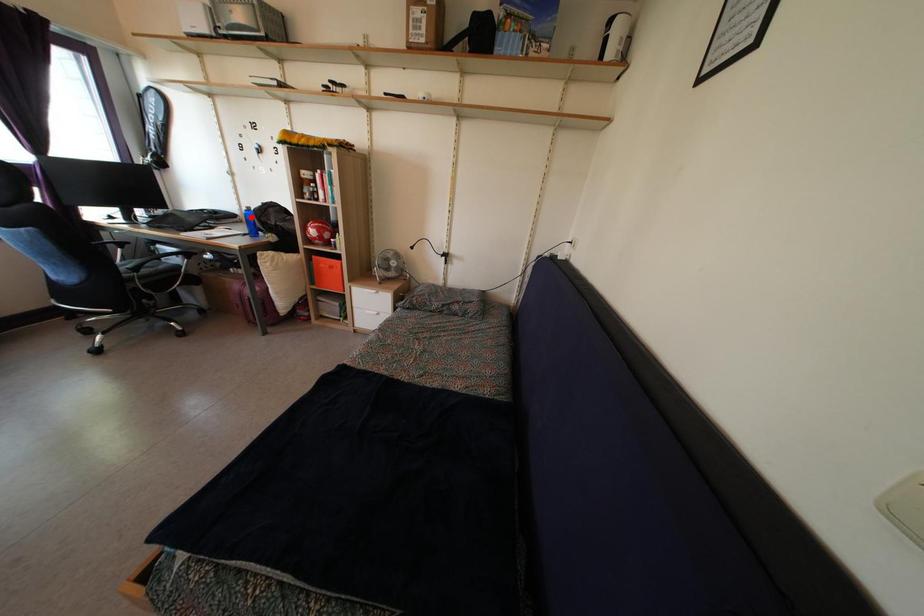
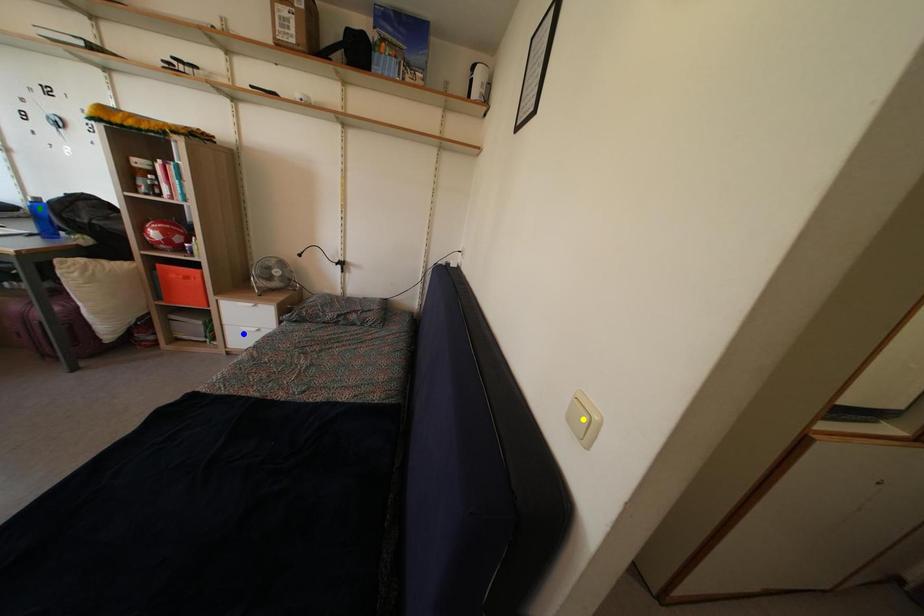
Question: I am providing you with two images of the same scene from different viewpoints. A red point is marked on the first image. You are given multiple points on the second image. Can you choose the point in image 2 that corresponds to the point in image 1?

Choices:
 (A) yellow point
 (B) blue point
 (C) green point

Answer: (C)